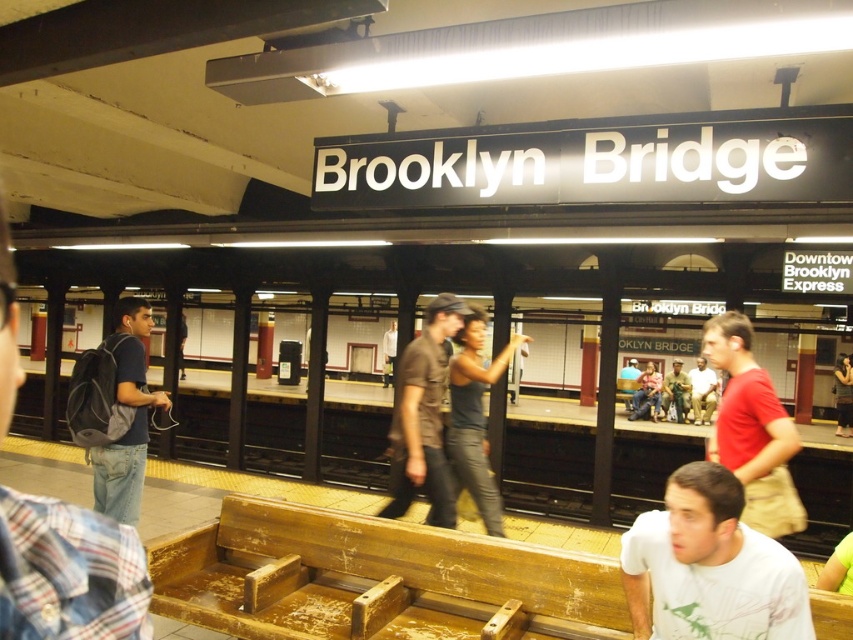
You are standing on the subway platform and see two people wearing shirts. One is the white matte shirt at lower right and the other is the camouflage fabric shirt at center. Which shirt is located to the left of the other?

The white matte shirt at lower right is positioned on the left side of camouflage fabric shirt at center.